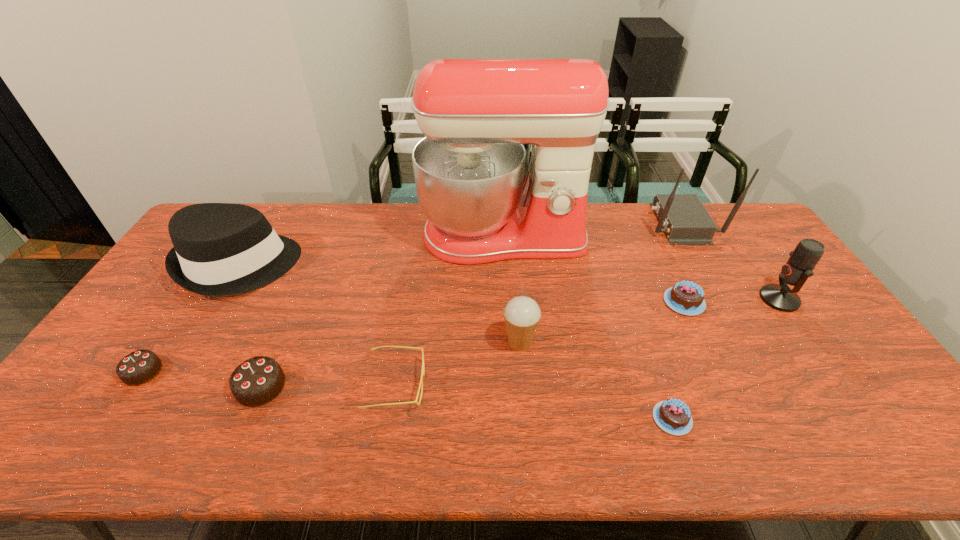
Identify the location of the leftmost chocolate cake. Image resolution: width=960 pixels, height=540 pixels. (138, 367).

At what (x,y) coordinates should I click in order to perform the action: click on the left chocolate chocolate cake. Please return your answer as a coordinate pair (x, y). Looking at the image, I should click on (138, 367).

Locate an element on the screen. spectacles is located at coordinates (422, 372).

Find the location of a particular element. The height and width of the screenshot is (540, 960). the nearer pink chocolate cake is located at coordinates (673, 416).

You are a GUI agent. You are given a task and a screenshot of the screen. Output one action in this format:
    pyautogui.click(x=<x>, y=<y>)
    Task: Click on the shortest chocolate cake
    Image resolution: width=960 pixels, height=540 pixels.
    Given the screenshot: What is the action you would take?
    pyautogui.click(x=673, y=416)

Find the location of a particular element. The width and height of the screenshot is (960, 540). vacant space situated on the front-facing side of the mixer is located at coordinates (506, 282).

Where is `free space located on the back of the router to connect cables`? free space located on the back of the router to connect cables is located at coordinates (622, 223).

This screenshot has height=540, width=960. What are the coordinates of `free space located on the back of the router to connect cables` in the screenshot? It's located at (605, 223).

At what (x,y) coordinates should I click in order to perform the action: click on free location located on the back of the router to connect cables. Please return your answer as a coordinate pair (x, y). The image size is (960, 540). Looking at the image, I should click on (566, 223).

Where is `vacant space situated on the side of the microphone with the red ring`? vacant space situated on the side of the microphone with the red ring is located at coordinates (744, 299).